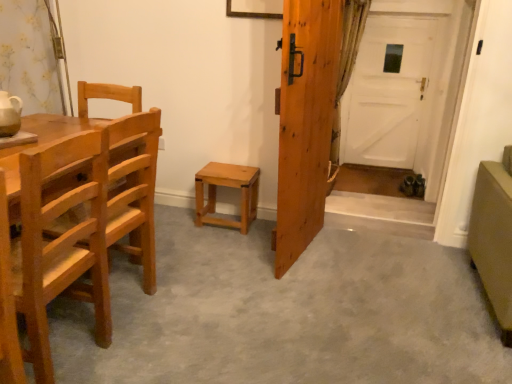
Question: Is light brown wood chair at left, the 1th chair in the front-to-back sequence, located within green textured curtain at right?

Choices:
 (A) yes
 (B) no

Answer: (B)

Question: Is green textured curtain at right looking in the opposite direction of light brown wood chair at left, the 1th chair in the front-to-back sequence?

Choices:
 (A) no
 (B) yes

Answer: (A)

Question: Is green textured curtain at right oriented towards light brown wood chair at left, the second chair when ordered from back to front?

Choices:
 (A) no
 (B) yes

Answer: (A)

Question: Does green textured curtain at right have a lesser height compared to light brown wood chair at left, the 1th chair in the front-to-back sequence?

Choices:
 (A) yes
 (B) no

Answer: (B)

Question: Can you confirm if green textured curtain at right is thinner than light brown wood chair at left, the second chair when ordered from back to front?

Choices:
 (A) yes
 (B) no

Answer: (A)

Question: In terms of width, does light brown wood chair at left, the 2th chair viewed from the front, look wider or thinner when compared to light brown wood stool at center?

Choices:
 (A) thin
 (B) wide

Answer: (B)

Question: Is light brown wood chair at left, the 2th chair viewed from the front, inside the boundaries of light brown wood stool at center, or outside?

Choices:
 (A) outside
 (B) inside

Answer: (A)

Question: Based on their positions, is light brown wood chair at left, which is counted as the 1th chair, starting from the back, located to the left or right of light brown wood stool at center?

Choices:
 (A) left
 (B) right

Answer: (A)

Question: From the image's perspective, is light brown wood chair at left, the 2th chair viewed from the front, above or below light brown wood stool at center?

Choices:
 (A) above
 (B) below

Answer: (B)

Question: Would you say green textured curtain at right is to the left or to the right of light brown wood chair at left, the second chair when ordered from back to front, in the picture?

Choices:
 (A) right
 (B) left

Answer: (A)

Question: From a real-world perspective, relative to light brown wood chair at left, the second chair when ordered from back to front, is green textured curtain at right vertically above or below?

Choices:
 (A) above
 (B) below

Answer: (A)

Question: Is green textured curtain at right situated inside light brown wood chair at left, the second chair when ordered from back to front, or outside?

Choices:
 (A) outside
 (B) inside

Answer: (A)

Question: In terms of height, does green textured curtain at right look taller or shorter compared to light brown wood chair at left, the second chair when ordered from back to front?

Choices:
 (A) tall
 (B) short

Answer: (A)

Question: Based on their sizes in the image, would you say matte olive-green armchair at lower right is bigger or smaller than wooden door at center, which is counted as the 1th door, starting from the left?

Choices:
 (A) small
 (B) big

Answer: (B)

Question: Considering their positions, is matte olive-green armchair at lower right located in front of or behind wooden door at center, which appears as the 2th door when viewed from the right?

Choices:
 (A) front
 (B) behind

Answer: (A)